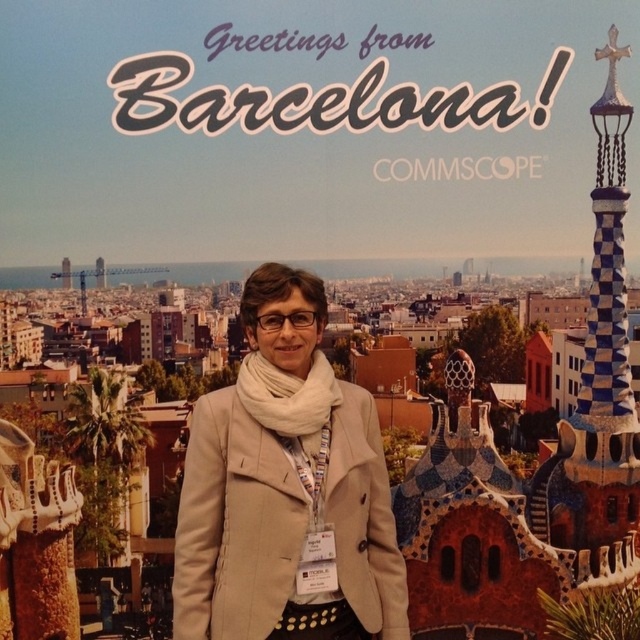
Question: Which of the following is the farthest from the observer?

Choices:
 (A) (301, 492)
 (B) (548, 493)

Answer: (B)

Question: Does beige wool coat at center appear on the right side of blue and white checkered tower at right?

Choices:
 (A) yes
 (B) no

Answer: (B)

Question: Is beige wool coat at center behind blue and white checkered tower at right?

Choices:
 (A) no
 (B) yes

Answer: (A)

Question: Can you confirm if beige wool coat at center is smaller than blue and white checkered tower at right?

Choices:
 (A) yes
 (B) no

Answer: (A)

Question: Which point is farther to the camera?

Choices:
 (A) (365, 508)
 (B) (547, 525)

Answer: (B)

Question: Which of the following is the closest to the observer?

Choices:
 (A) (595, 236)
 (B) (390, 620)

Answer: (B)